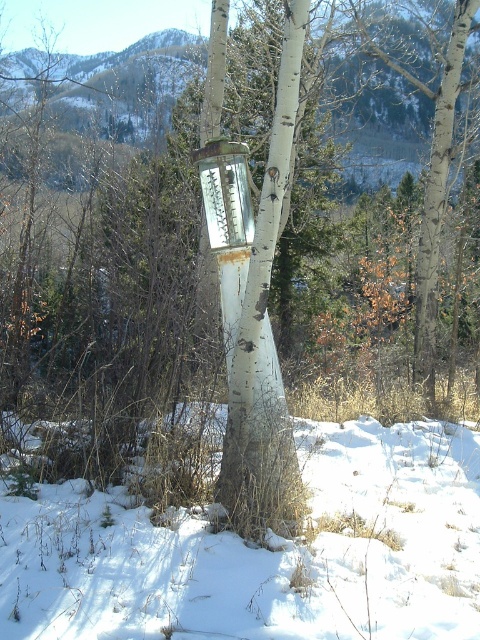
What is the relationship in size between the white powdery snow at lower center and the metallic glass thermometer at center in the snowy landscape?

The white powdery snow at lower center is bigger than the metallic glass thermometer at center.

Consider the image. You are standing in front of the snowy landscape scene. There are two points marked in the image. The first point is at coordinates point (379, 493) and the second is at point (237, 148). Which point is closer to you?

Point (237, 148) is closer to you because it is less further to the camera than point (379, 493).

You are a weather observer who needs to retrieve the metallic glass thermometer at center from its current position. To do so, you must step onto the white powdery snow at lower center. Is the snow sufficient to support your weight?

The white powdery snow at lower center is positioned under the metallic glass thermometer at center. Since the snow is beneath the thermometer, it is likely compacted and able to support your weight when stepping on it to retrieve the thermometer.